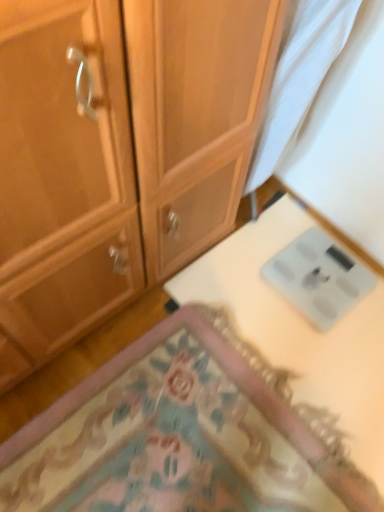
Question: Is carpeted mat at lower center wider or thinner than white sheer curtain at upper right?

Choices:
 (A) wide
 (B) thin

Answer: (A)

Question: In the image, is carpeted mat at lower center positioned in front of or behind white sheer curtain at upper right?

Choices:
 (A) front
 (B) behind

Answer: (B)

Question: Estimate the real-world distances between objects in this image. Which object is farther from the white glossy scale at lower right?

Choices:
 (A) carpeted mat at lower center
 (B) white sheer curtain at upper right

Answer: (B)

Question: Which object is positioned farthest from the white glossy scale at lower right?

Choices:
 (A) white sheer curtain at upper right
 (B) carpeted mat at lower center

Answer: (A)